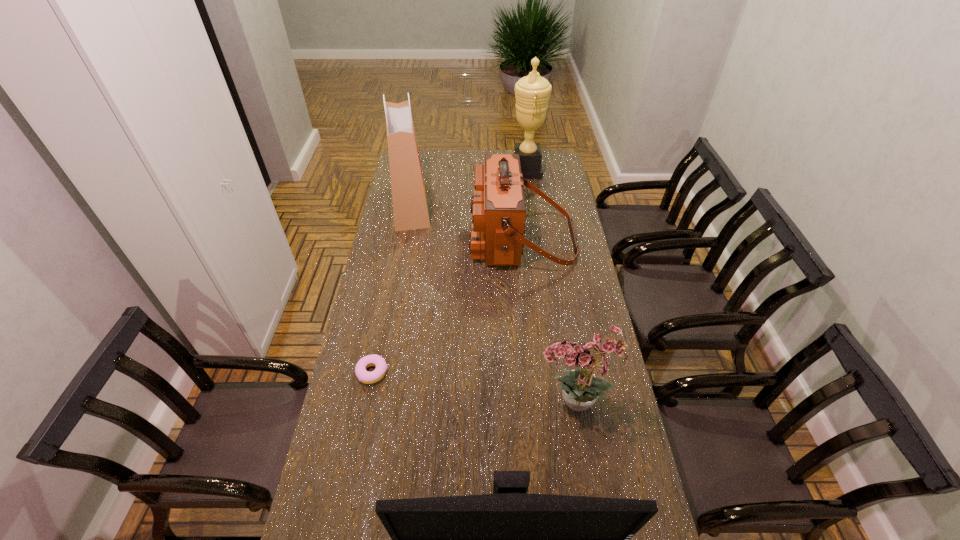
Identify the location of free space located on the front-facing side of the flower arrangement. The image size is (960, 540). (468, 405).

Find the location of a particular element. The height and width of the screenshot is (540, 960). free space located 0.190m on the front-facing side of the flower arrangement is located at coordinates (471, 405).

Find the location of a particular element. The height and width of the screenshot is (540, 960). free region located on the face side of the satchel is located at coordinates click(x=436, y=238).

At what (x,y) coordinates should I click in order to perform the action: click on vacant space located on the face side of the satchel. Please return your answer as a coordinate pair (x, y). The image size is (960, 540). Looking at the image, I should click on (401, 238).

The width and height of the screenshot is (960, 540). In order to click on free point located 0.360m on the face side of the satchel in this screenshot , I will do `click(388, 238)`.

Find the location of a particular element. The height and width of the screenshot is (540, 960). vacant space located 0.090m on the front of the shortest object is located at coordinates (365, 412).

Where is `object located in the far edge section of the desktop`? This screenshot has height=540, width=960. object located in the far edge section of the desktop is located at coordinates (532, 92).

Image resolution: width=960 pixels, height=540 pixels. I want to click on shopping bag present at the left edge, so (410, 209).

In order to click on doughnut that is positioned at the left edge in this screenshot , I will do `click(362, 374)`.

The width and height of the screenshot is (960, 540). Identify the location of trophy cup that is positioned at the right edge. (532, 92).